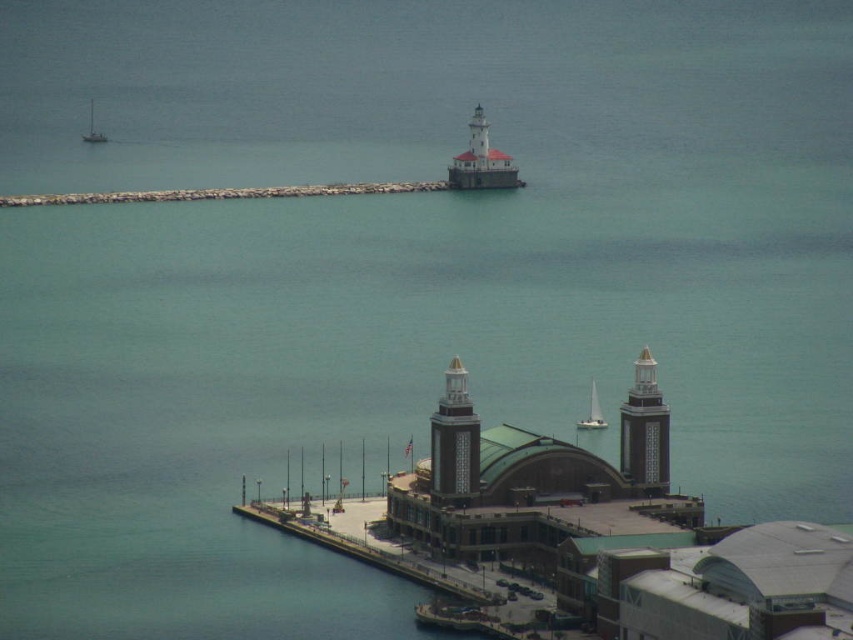
You are a photographer trying to capture the white painted concrete lighthouse at upper center and the white sailboat at upper left in the same frame. Based on their positions, which object will appear larger in your photo?

The white painted concrete lighthouse at upper center will appear larger in the photo because it is closer to the viewer than the white sailboat at upper left.

You are a photographer planning to capture the smooth gray tower at center and the white sailboat at upper left in a single shot. Based on their sizes, which object should you focus on to ensure both are clearly visible in the frame?

The smooth gray tower at center might be wider than the white sailboat at upper left, so focusing on the tower would help ensure both are visible as the tower occupies more space.